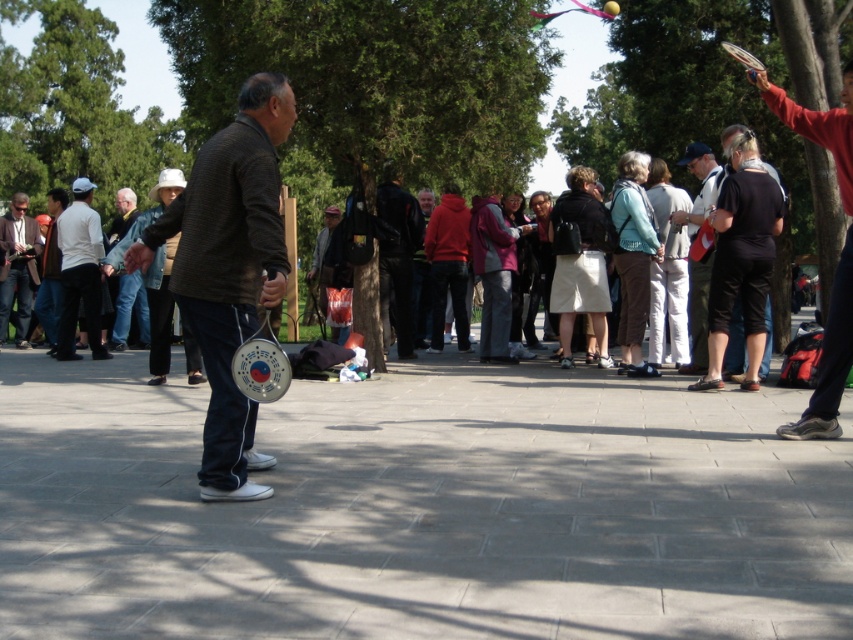
Question: Which point is farther to the camera?

Choices:
 (A) click(844, 72)
 (B) click(688, 364)
 (C) click(227, 460)

Answer: (B)

Question: Is reddish-brown leather jacket at right below camouflage pants at center?

Choices:
 (A) no
 (B) yes

Answer: (B)

Question: Does dark gray sweater at center appear under dark gray sweater at left?

Choices:
 (A) yes
 (B) no

Answer: (A)

Question: Among these points, which one is nearest to the camera?

Choices:
 (A) (828, 353)
 (B) (228, 324)
 (C) (695, 296)

Answer: (B)

Question: Among these points, which one is nearest to the camera?

Choices:
 (A) (694, 212)
 (B) (27, 288)

Answer: (A)

Question: Does camouflage pants at center have a smaller size compared to dark gray sweater at left?

Choices:
 (A) no
 (B) yes

Answer: (A)